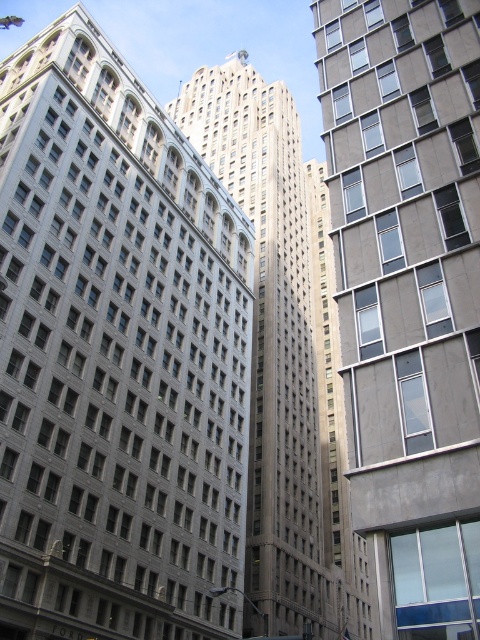
You are standing in the city and want to take a photo of the gray stone building at center. If your camera can focus on objects up to 40 meters away, will you be able to capture a clear image?

The gray stone building at center is 38.44 meters away from the viewer, which is within the camera focus range of up to 40 meters. Therefore, you can capture a clear image.

You are standing in the cityscape and want to take a photo. You notice two points marked in the image. The first point is at coordinates point (95, 522) and the second is at point (451, 161). Which point is closer to your camera?

Point (95, 522) is closer to the camera than point (451, 161) because it is further to the camera than the latter.

You are standing in the city square and want to take a photo of both the gray stone building at center and the gray concrete building at right. Which building should you position yourself closer to in order to capture both in the same frame?

You should position yourself closer to the gray stone building at center because it is located below the gray concrete building at right, allowing both to be captured in the same frame when closer to the lower one.